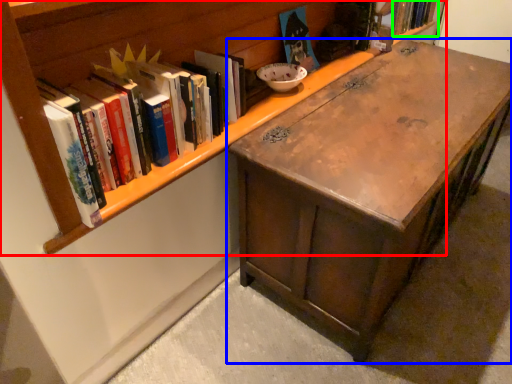
Question: Estimate the real-world distances between objects in this image. Which object is farther from bookcase (highlighted by a red box), desk (highlighted by a blue box) or book (highlighted by a green box)?

Choices:
 (A) desk
 (B) book

Answer: (B)